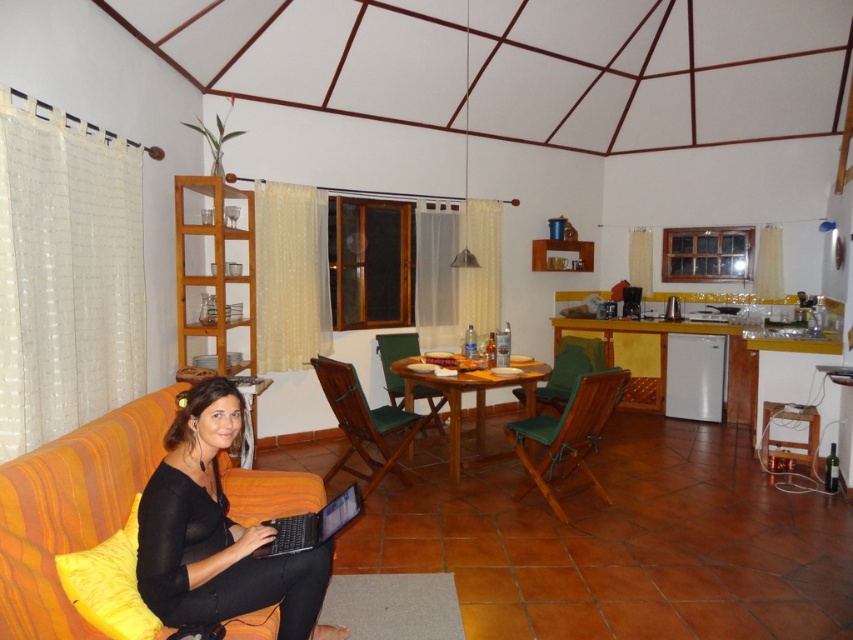
You are a guest in this living space and want to place your bag on the nearest available surface. Which object should you choose between the black matte laptop at lower left and the wooden dining table at center?

The wooden dining table at center is the correct choice because the black matte laptop at lower left is located below it, making the table a more accessible and appropriate surface for placing your bag.

The wooden dining table at center is at point (467, 392). If you are standing at point 0.5, 0.5, which direction should you move to reach the wooden dining table at center?

To reach the wooden dining table at center from point 0.5, 0.5, you should move northeast because the table is located at point (467, 392), which is northeast of your current position.

You are a delivery person who needs to place a small package between the black matte laptop at lower left and the black plastic laptop at lower left. The package is 8 inches long. Can it fit in the space between them?

The distance between the black matte laptop at lower left and the black plastic laptop at lower left is 7.18 inches. Since the package is 8 inches long, it cannot fit in the space between them.